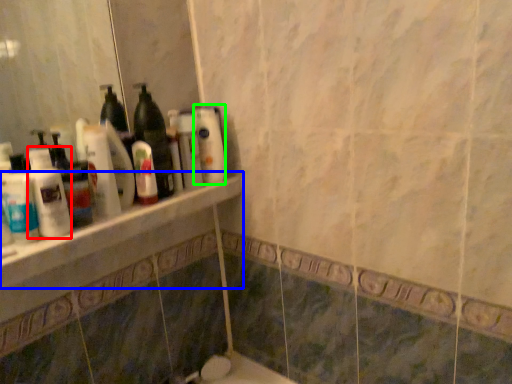
Question: Which object is positioned farthest from cleaning product (highlighted by a red box)? Select from ledge (highlighted by a blue box) and cleaning product (highlighted by a green box).

Choices:
 (A) ledge
 (B) cleaning product

Answer: (B)